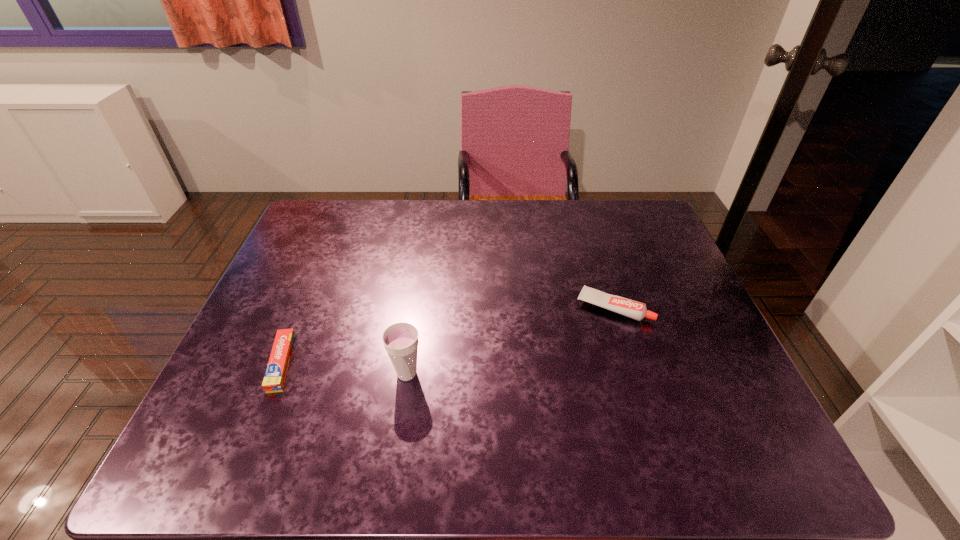
Locate an element on the screen. This screenshot has width=960, height=540. blank region between the right toothpaste and the second object from right to left is located at coordinates point(511,340).

Identify the location of free space between the second shortest object and the shortest object. click(x=447, y=335).

Where is `free spot between the second shortest object and the nearer toothpaste`? This screenshot has height=540, width=960. free spot between the second shortest object and the nearer toothpaste is located at coordinates (447, 335).

Locate an element on the screen. This screenshot has height=540, width=960. unoccupied position between the second shortest object and the left toothpaste is located at coordinates (447, 335).

Locate an element on the screen. The height and width of the screenshot is (540, 960). free space that is in between the rightmost object and the cup is located at coordinates (511, 340).

This screenshot has width=960, height=540. What are the coordinates of `unoccupied area between the second tallest object and the nearer toothpaste` in the screenshot? It's located at (447, 335).

Locate which object is the second closest to the farther toothpaste. Please provide its 2D coordinates. Your answer should be formatted as a tuple, i.e. [(x, y)], where the tuple contains the x and y coordinates of a point satisfying the conditions above.

[(275, 377)]

The image size is (960, 540). Find the location of `object that is the closest to the second shortest object`. object that is the closest to the second shortest object is located at coordinates (400, 340).

The image size is (960, 540). I want to click on free space that satisfies the following two spatial constraints: 1. on the back side of the second tallest object; 2. on the left side of the tallest object, so click(417, 307).

Locate an element on the screen. vacant position in the image that satisfies the following two spatial constraints: 1. on the back side of the second shortest object; 2. on the left side of the leftmost object is located at coordinates (305, 307).